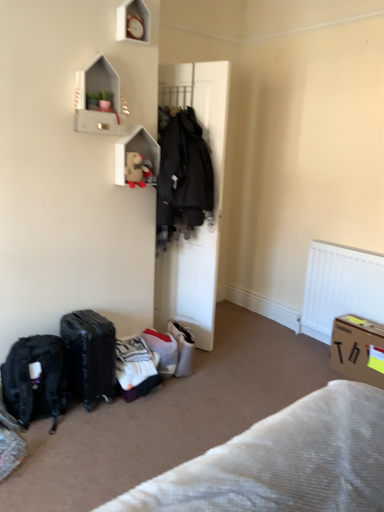
Find the location of `spots to the right of white matte door at center`. spots to the right of white matte door at center is located at coordinates (235, 349).